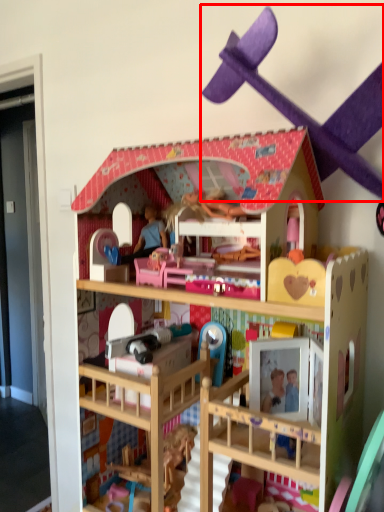
Question: Where is toy (annotated by the red box) located in relation to toy in the image?

Choices:
 (A) right
 (B) left

Answer: (A)